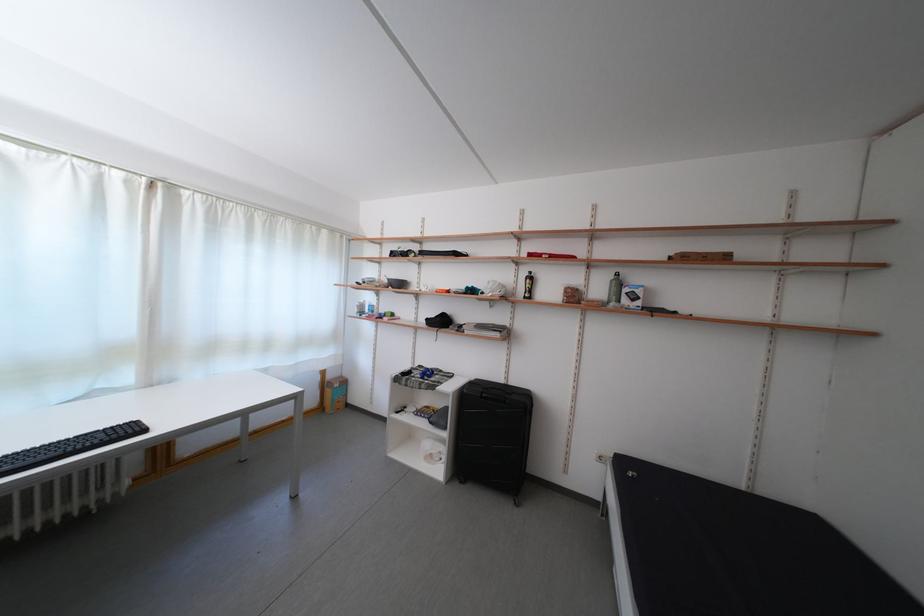
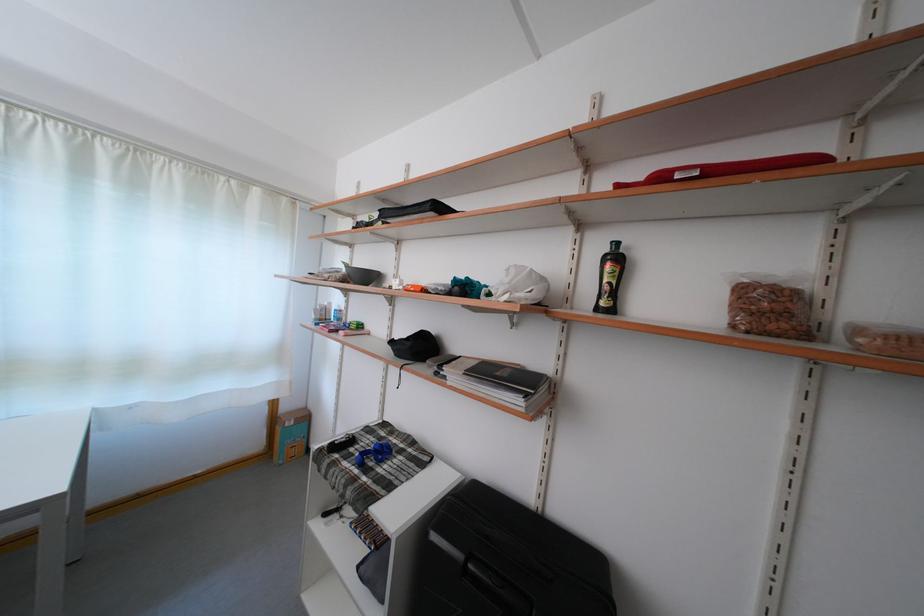
The point at [533,302] is marked in the first image. Where is the corresponding point in the second image?

(606, 314)